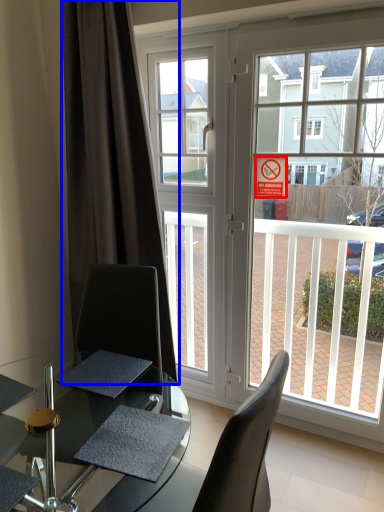
Question: Which object is further to the camera taking this photo, parking sign (highlighted by a red box) or curtain (highlighted by a blue box)?

Choices:
 (A) parking sign
 (B) curtain

Answer: (A)